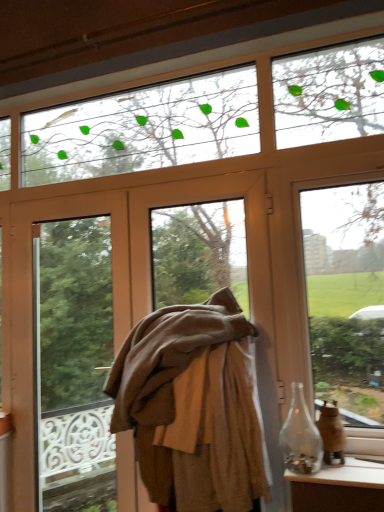
The image size is (384, 512). Describe the element at coordinates (300, 437) in the screenshot. I see `transparent glass bottle at lower right` at that location.

This screenshot has height=512, width=384. What do you see at coordinates (347, 305) in the screenshot? I see `transparent glass window at upper right` at bounding box center [347, 305].

This screenshot has height=512, width=384. I want to click on translucent glass vase at right, so click(331, 433).

Locate an element on the screen. The image size is (384, 512). transparent glass jar at lower right is located at coordinates (339, 488).

Locate an element on the screen. Image resolution: width=384 pixels, height=512 pixels. transparent glass bottle at lower right is located at coordinates (300, 437).

Who is bigger, transparent glass window at upper right or translucent glass vase at right?

With larger size is transparent glass window at upper right.

Considering the sizes of objects transparent glass window at upper right and translucent glass vase at right in the image provided, who is wider, transparent glass window at upper right or translucent glass vase at right?

With larger width is translucent glass vase at right.

From the image's perspective, would you say transparent glass window at upper right is positioned over translucent glass vase at right?

Correct, transparent glass window at upper right appears higher than translucent glass vase at right in the image.

Can you confirm if transparent glass window at upper right is taller than translucent glass vase at right?

Correct, transparent glass window at upper right is much taller as translucent glass vase at right.

How different are the orientations of transparent glass jar at lower right and transparent glass window at upper right in degrees?

They differ by 1.72 degrees in their facing directions.

Could you tell me if transparent glass jar at lower right is facing transparent glass window at upper right?

No, transparent glass jar at lower right does not turn towards transparent glass window at upper right.

Are transparent glass jar at lower right and transparent glass window at upper right far apart?

That's not correct — transparent glass jar at lower right is a little close to transparent glass window at upper right.

Is transparent glass jar at lower right to the left of transparent glass window at upper right from the viewer's perspective?

Correct, you'll find transparent glass jar at lower right to the left of transparent glass window at upper right.

Between transparent glass jar at lower right and translucent glass vase at right, which one has less height?

With less height is transparent glass jar at lower right.

Is point (351, 492) closer or farther from the camera than point (332, 420)?

Clearly, point (351, 492) is closer to the camera than point (332, 420).

Between transparent glass jar at lower right and translucent glass vase at right, which one has smaller size?

translucent glass vase at right.

Which of these two, transparent glass jar at lower right or translucent glass vase at right, is thinner?

translucent glass vase at right is thinner.

Considering the positions of points (382, 489) and (214, 348), is point (382, 489) closer to camera compared to point (214, 348)?

Yes.

At what (x,y) coordinates should I click in order to perform the action: click on clothing above the transparent glass jar at lower right (from a real-world perspective). Please return your answer as a coordinate pair (x, y). This screenshot has width=384, height=512. Looking at the image, I should click on (193, 406).

Consider the image. Is transparent glass jar at lower right oriented away from brown woolen coat at center?

No, brown woolen coat at center is not at the back of transparent glass jar at lower right.

Between transparent glass jar at lower right and brown woolen coat at center, which one has larger size?

brown woolen coat at center.

Is transparent glass jar at lower right wider than brown fabric at center?

Yes.

You are a GUI agent. You are given a task and a screenshot of the screen. Output one action in this format:
    pyautogui.click(x=<x>, y=<y>)
    Task: Click on the door above the transparent glass jar at lower right (from a real-world perspective)
    The height and width of the screenshot is (512, 384).
    Given the screenshot: What is the action you would take?
    pyautogui.click(x=151, y=268)

Between point (300, 490) and point (145, 213), which one is positioned behind?

The point (145, 213) is behind.

From the picture: Could you tell me if brown fabric at center is turned towards transparent glass jar at lower right?

No, brown fabric at center is not oriented towards transparent glass jar at lower right.

Are brown fabric at center and transparent glass jar at lower right far apart?

brown fabric at center is near transparent glass jar at lower right, not far away.

From a real-world perspective, between brown fabric at center and transparent glass jar at lower right, who is vertically lower?

transparent glass jar at lower right, from a real-world perspective.

Does brown fabric at center have a greater height compared to transparent glass jar at lower right?

Correct, brown fabric at center is much taller as transparent glass jar at lower right.

Are transparent glass bottle at lower right and transparent glass window at upper right making contact?

No, transparent glass bottle at lower right is not touching transparent glass window at upper right.

Which is in front, point (288, 440) or point (362, 234)?

Positioned in front is point (288, 440).

Which is more to the left, transparent glass bottle at lower right or transparent glass window at upper right?

transparent glass bottle at lower right is more to the left.

From a real-world perspective, which is physically above, transparent glass bottle at lower right or transparent glass window at upper right?

transparent glass window at upper right is physically above.

This screenshot has width=384, height=512. I want to click on window above the translucent glass vase at right (from the image's perspective), so click(x=347, y=305).

This screenshot has width=384, height=512. I want to click on furniture in front of the transparent glass window at upper right, so click(x=339, y=488).

Looking at the image, which one is located further to transparent glass jar at lower right, translucent glass vase at right or transparent glass window at upper right?

transparent glass window at upper right is positioned further to the anchor transparent glass jar at lower right.

Estimate the real-world distances between objects in this image. Which object is closer to transparent glass window at upper right, translucent glass vase at right or brown woolen coat at center?

Based on the image, translucent glass vase at right appears to be nearer to transparent glass window at upper right.

Looking at the image, which one is located further to transparent glass window at upper right, transparent glass jar at lower right or brown fabric at center?

brown fabric at center lies further to transparent glass window at upper right than the other object.

Looking at the image, which one is located further to transparent glass window at upper right, brown woolen coat at center or transparent glass bottle at lower right?

brown woolen coat at center lies further to transparent glass window at upper right than the other object.

Estimate the real-world distances between objects in this image. Which object is closer to translucent glass vase at right, brown fabric at center or transparent glass jar at lower right?

transparent glass jar at lower right is positioned closer to the anchor translucent glass vase at right.

Based on the photo, considering their positions, is transparent glass jar at lower right positioned closer to brown fabric at center than brown woolen coat at center?

The object closer to brown fabric at center is brown woolen coat at center.

Based on their spatial positions, is transparent glass bottle at lower right or translucent glass vase at right closer to transparent glass jar at lower right?

The object closer to transparent glass jar at lower right is translucent glass vase at right.

Estimate the real-world distances between objects in this image. Which object is further from brown woolen coat at center, transparent glass jar at lower right or brown fabric at center?

Among the two, transparent glass jar at lower right is located further to brown woolen coat at center.

Where is `door situated between brown woolen coat at center and translucent glass vase at right from left to right`? Image resolution: width=384 pixels, height=512 pixels. door situated between brown woolen coat at center and translucent glass vase at right from left to right is located at coordinates (151, 268).

Image resolution: width=384 pixels, height=512 pixels. In order to click on door between brown woolen coat at center and transparent glass jar at lower right in the horizontal direction in this screenshot , I will do `click(151, 268)`.

Identify the location of bottle between transparent glass window at upper right and translucent glass vase at right in the vertical direction. This screenshot has width=384, height=512. (300, 437).

This screenshot has width=384, height=512. In order to click on glass vase that lies between transparent glass window at upper right and transparent glass jar at lower right from top to bottom in this screenshot , I will do `click(331, 433)`.